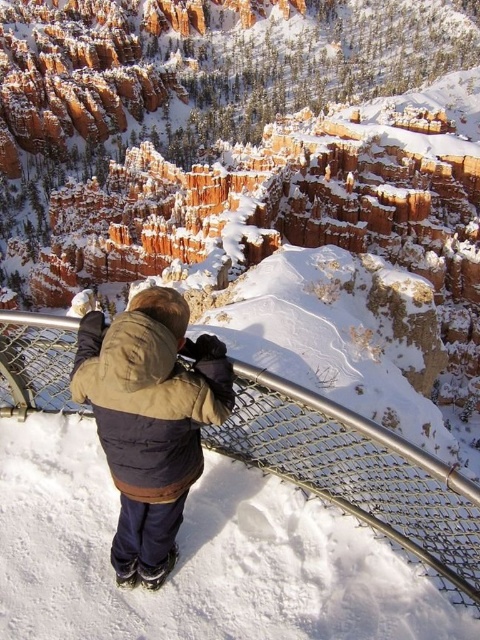
Between metal mesh railing at center and brown fuzzy jacket at center, which one has more height?

metal mesh railing at center

Does metal mesh railing at center have a greater width compared to brown fuzzy jacket at center?

Yes, metal mesh railing at center is wider than brown fuzzy jacket at center.

Measure the distance between metal mesh railing at center and camera.

metal mesh railing at center is 80.93 feet away from camera.

You are a GUI agent. You are given a task and a screenshot of the screen. Output one action in this format:
    pyautogui.click(x=<x>, y=<y>)
    Task: Click on the metal mesh railing at center
    This screenshot has height=640, width=480.
    Given the screenshot: What is the action you would take?
    pyautogui.click(x=358, y=474)